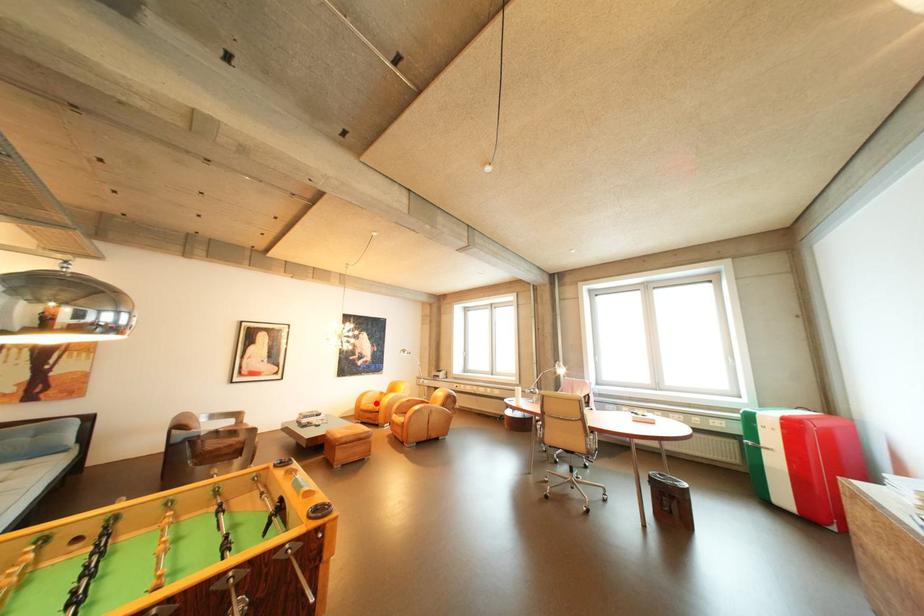
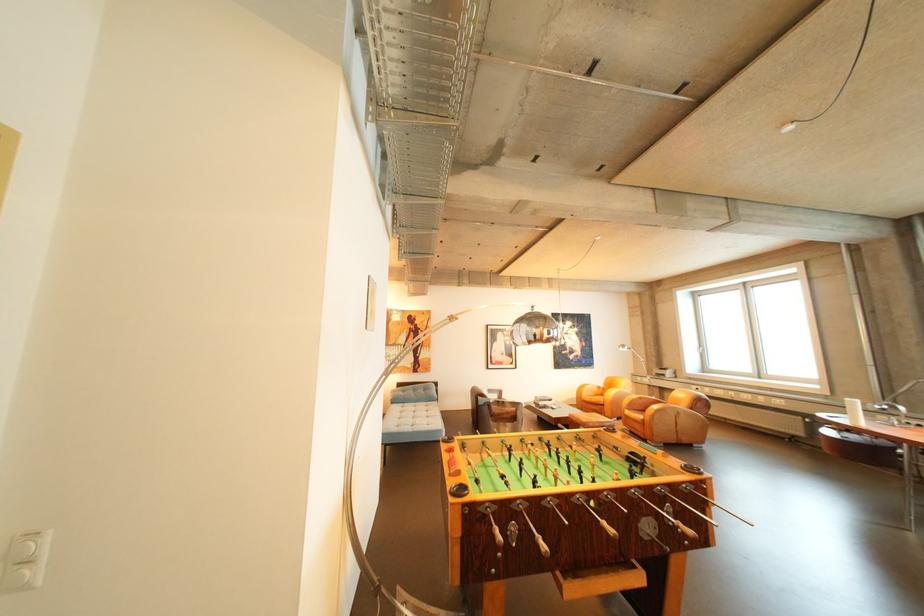
In the second image, find the point that corresponds to the highlighted location in the first image.

(598, 395)